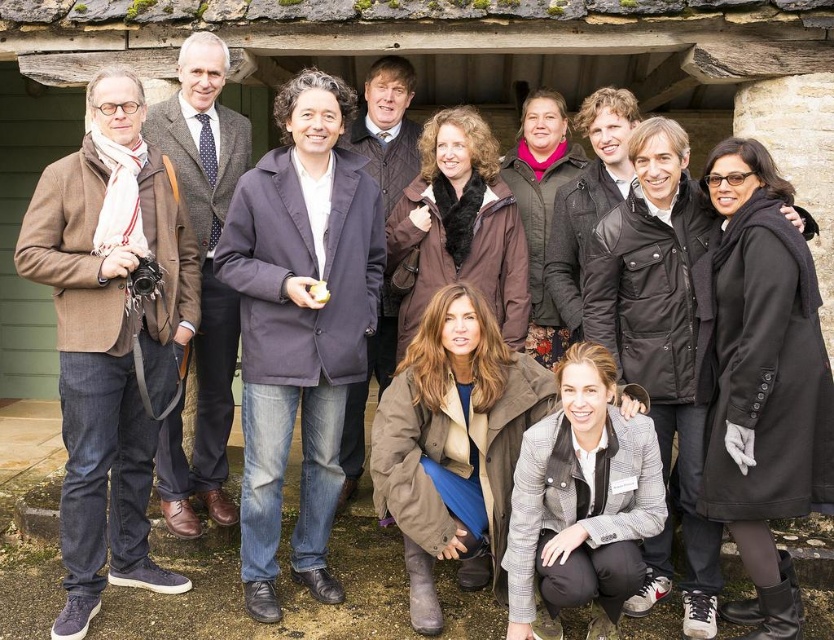
You are standing at the origin point of the image coordinate system. You want to move towards the point with coordinates point (x=122, y=205). However, there is an obstacle located at point (x=751, y=436). Will you collide with the obstacle?

Since point (x=122, y=205) is behind point (x=751, y=436), moving towards point (x=122, y=205) would mean moving away from the obstacle at point (x=751, y=436). Therefore, you will not collide with the obstacle.

You are standing in front of the rustic wooden structure and want to touch the brown woolen jacket at left. If you move straight forward, will your hand reach the point at coordinates point (109, 337)?

The point (109, 337) is on the brown woolen jacket at left, so yes, moving straight forward will allow your hand to reach that point on the brown woolen jacket at left.